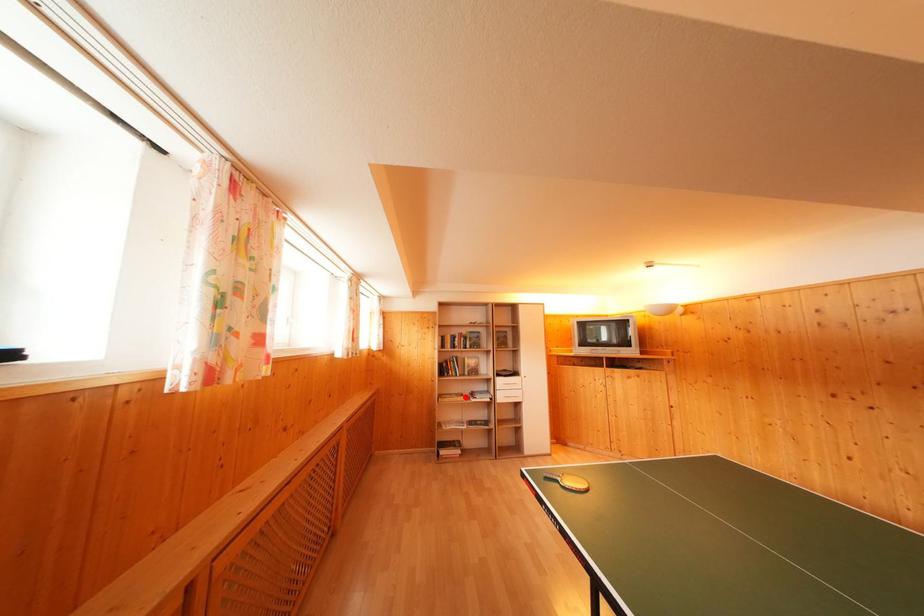
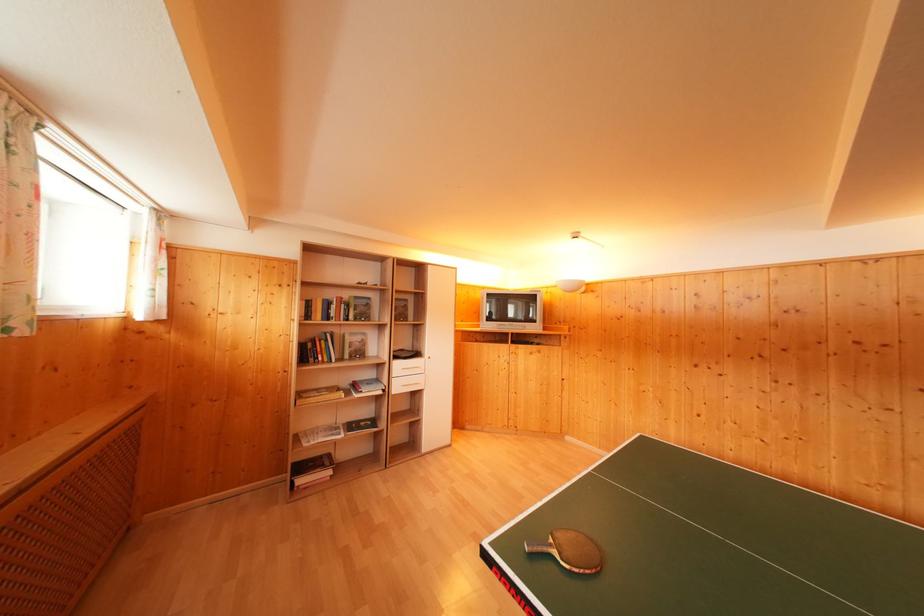
Locate, in the second image, the point that corresponds to the highlighted location in the first image.

(341, 390)